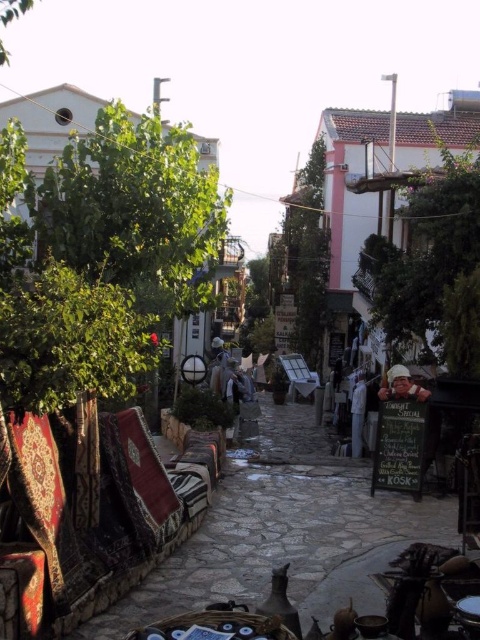
Does green leafy tree at center appear on the right side of matte khaki helmet at center?

Incorrect, green leafy tree at center is not on the right side of matte khaki helmet at center.

Does point (309, 298) lie behind point (412, 390)?

Yes, point (309, 298) is farther from viewer.

Does point (286, 264) come behind point (382, 384)?

That is True.

You are a GUI agent. You are given a task and a screenshot of the screen. Output one action in this format:
    pyautogui.click(x=<x>, y=<y>)
    Task: Click on the green leafy tree at center
    The width and height of the screenshot is (480, 640).
    Given the screenshot: What is the action you would take?
    pyautogui.click(x=308, y=253)

Is point (371, 512) farther from viewer compared to point (354, 422)?

No, (371, 512) is closer to viewer.

Can you confirm if carpeted rug at left is smaller than white fabric at center?

No.

Locate an element on the screen. Image resolution: width=480 pixels, height=640 pixels. carpeted rug at left is located at coordinates (283, 531).

What do you see at coordinates (432, 260) in the screenshot? I see `green leafy tree at upper right` at bounding box center [432, 260].

Which is below, green leafy tree at upper right or matte khaki helmet at center?

matte khaki helmet at center

Is point (372, 292) closer to viewer compared to point (392, 372)?

No.

Find the location of `green leafy tree at upper right`. green leafy tree at upper right is located at coordinates (432, 260).